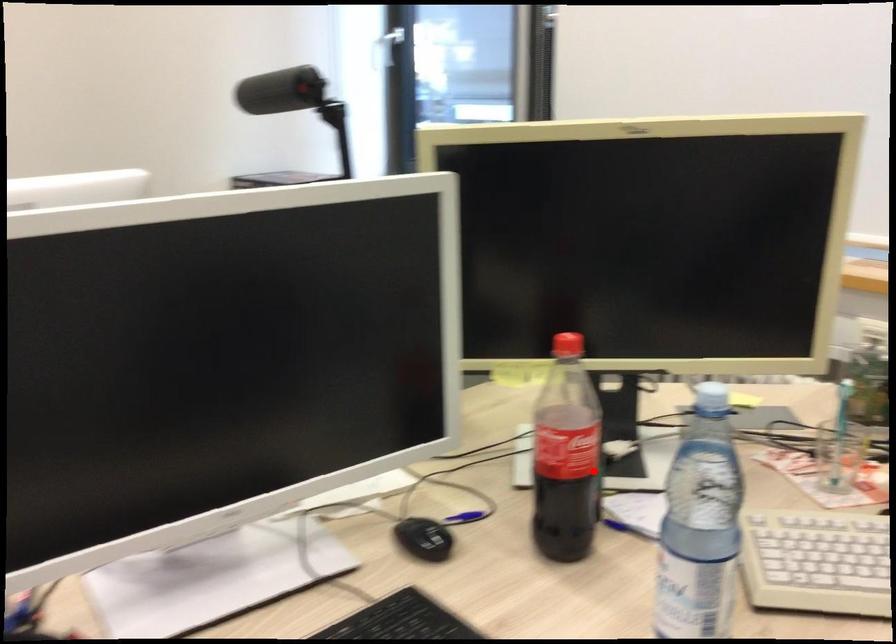
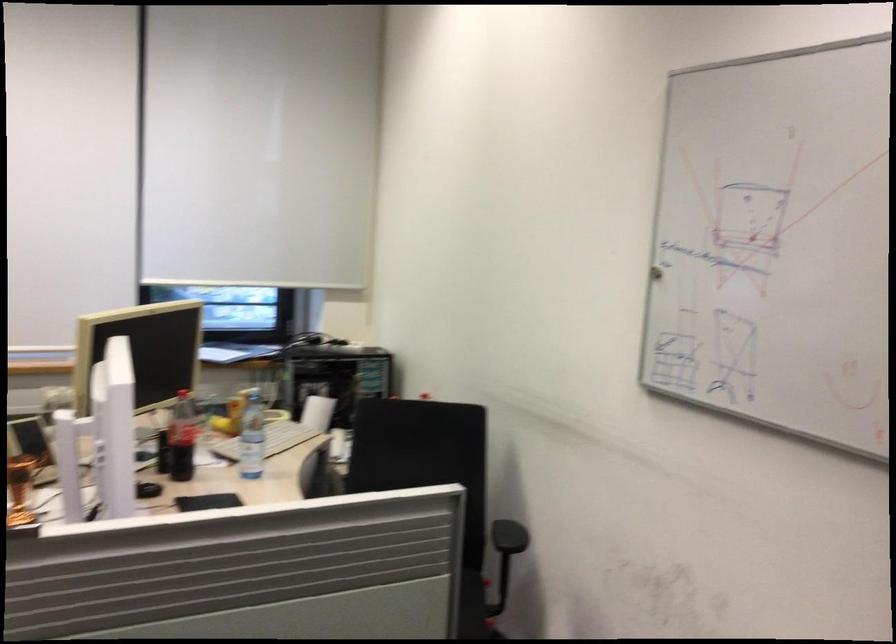
Find the pixel in the second image that matches the highlighted location in the first image.

(182, 438)